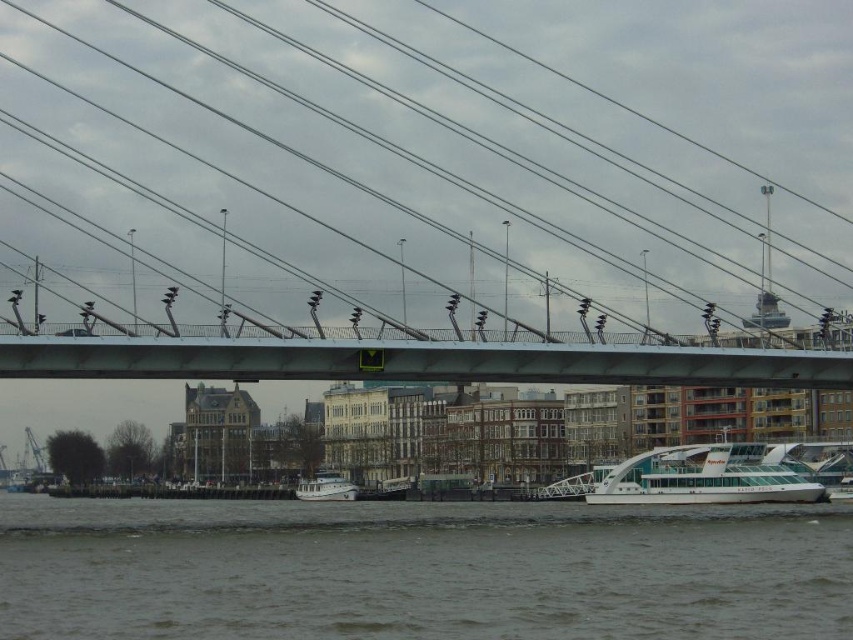
Can you confirm if metallic wires at center is taller than gray water at lower center?

Yes.

Identify the location of metallic wires at center. (376, 176).

Identify the location of metallic wires at center. This screenshot has width=853, height=640. (376, 176).

The width and height of the screenshot is (853, 640). Describe the element at coordinates (376, 176) in the screenshot. I see `metallic wires at center` at that location.

Is metallic wires at center in front of white matte boat at center?

Yes, it is.

This screenshot has width=853, height=640. What do you see at coordinates (376, 176) in the screenshot?
I see `metallic wires at center` at bounding box center [376, 176].

Where is `metallic wires at center`? This screenshot has height=640, width=853. metallic wires at center is located at coordinates (376, 176).

Which is more to the right, metallic gray bridge at center or white matte boat at center?

metallic gray bridge at center

Based on the photo, is metallic gray bridge at center smaller than white matte boat at center?

No.

Who is more forward, (442, 364) or (325, 476)?

Point (442, 364) is more forward.

At what (x,y) coordinates should I click in order to perform the action: click on metallic gray bridge at center. Please return your answer as a coordinate pair (x, y). Looking at the image, I should click on [x=416, y=362].